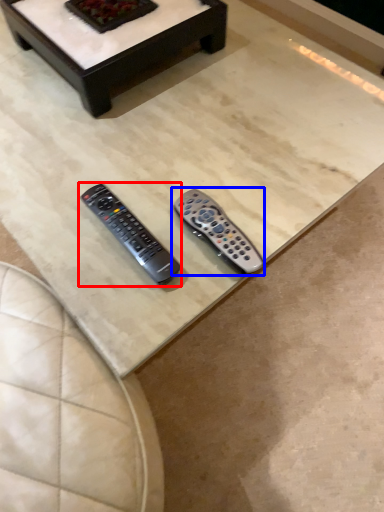
Question: Among these objects, which one is farthest to the camera, remote control (highlighted by a red box) or remote control (highlighted by a blue box)?

Choices:
 (A) remote control
 (B) remote control

Answer: (B)